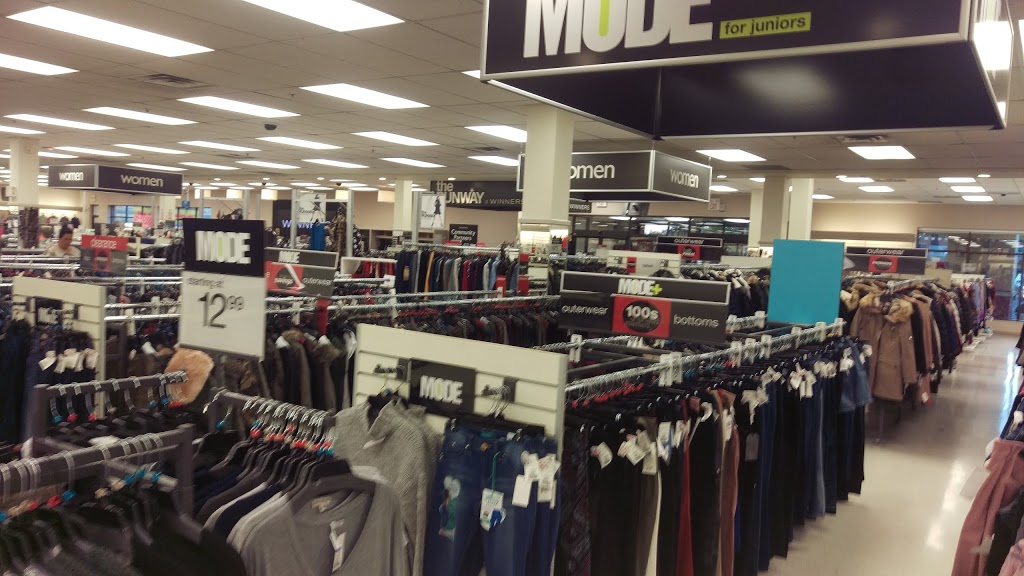
I want to click on shiny floor, so click(x=896, y=517).